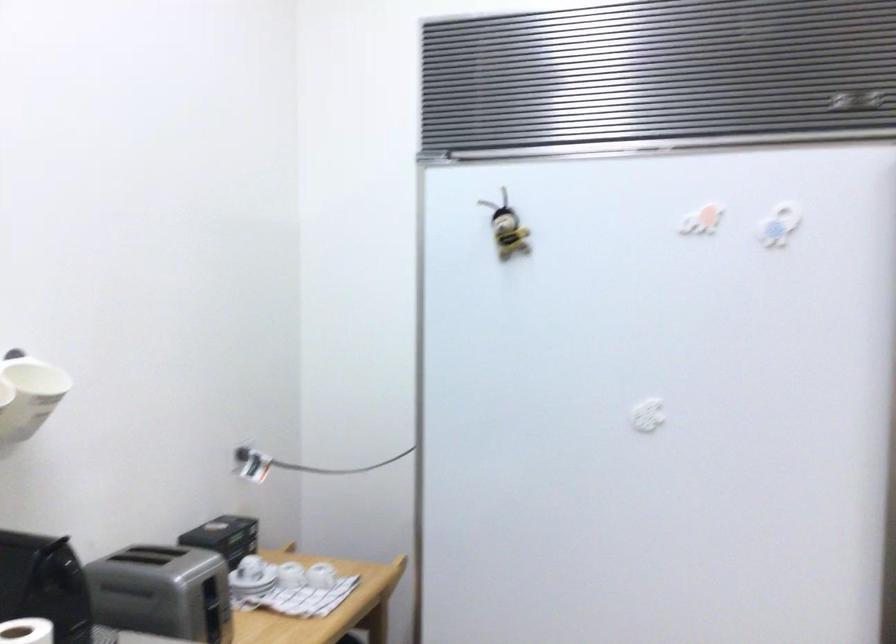
Where would you grasp the white mug handle? Please return your answer as a coordinate pair (x, y).

(5, 393)